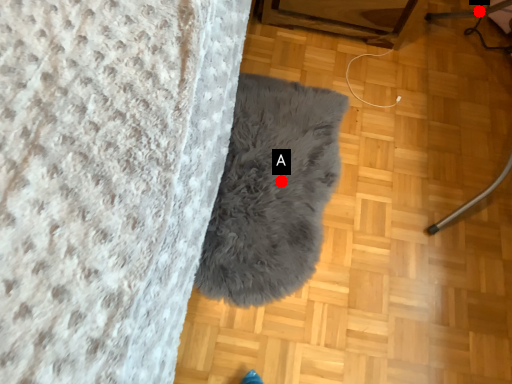
Question: Two points are circled on the image, labeled by A and B beside each circle. Which point is further to the camera?

Choices:
 (A) A is further
 (B) B is further

Answer: (B)